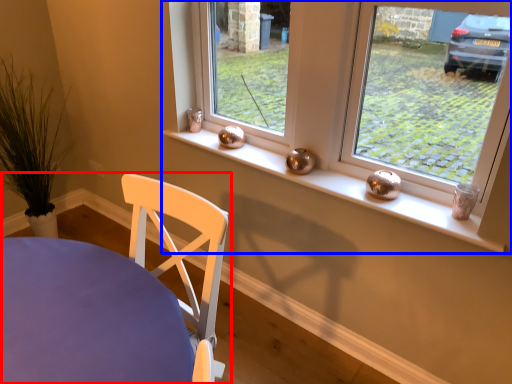
Question: Among these objects, which one is nearest to the camera, chair (highlighted by a red box) or window (highlighted by a blue box)?

Choices:
 (A) chair
 (B) window

Answer: (A)